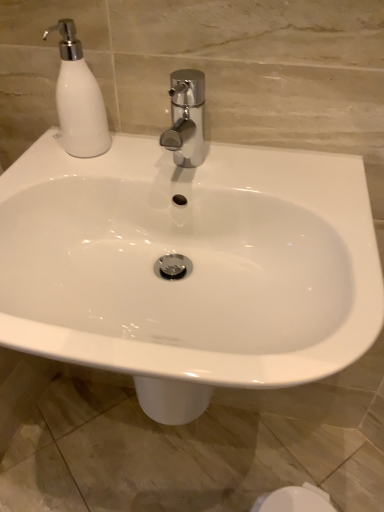
Question: Considering the relative sizes of white glossy soap dispenser at upper left and white glossy sink at center in the image provided, is white glossy soap dispenser at upper left smaller than white glossy sink at center?

Choices:
 (A) yes
 (B) no

Answer: (A)

Question: Does white glossy soap dispenser at upper left appear on the right side of white glossy sink at center?

Choices:
 (A) yes
 (B) no

Answer: (B)

Question: Is white glossy soap dispenser at upper left located outside white glossy sink at center?

Choices:
 (A) yes
 (B) no

Answer: (A)

Question: Could you tell me if white glossy soap dispenser at upper left is turned towards white glossy sink at center?

Choices:
 (A) yes
 (B) no

Answer: (B)

Question: Is white glossy soap dispenser at upper left in contact with white glossy sink at center?

Choices:
 (A) yes
 (B) no

Answer: (B)

Question: Does white glossy soap dispenser at upper left have a greater height compared to white glossy sink at center?

Choices:
 (A) yes
 (B) no

Answer: (B)

Question: From the image's perspective, does white glossy sink at center appear lower than white glossy soap dispenser at upper left?

Choices:
 (A) yes
 (B) no

Answer: (A)

Question: Would you say white glossy sink at center contains white glossy soap dispenser at upper left?

Choices:
 (A) yes
 (B) no

Answer: (B)

Question: Considering the relative sizes of white glossy sink at center and white glossy soap dispenser at upper left in the image provided, is white glossy sink at center thinner than white glossy soap dispenser at upper left?

Choices:
 (A) yes
 (B) no

Answer: (B)

Question: Is white glossy sink at center located outside white glossy soap dispenser at upper left?

Choices:
 (A) no
 (B) yes

Answer: (B)

Question: Could you tell me if white glossy sink at center is facing white glossy soap dispenser at upper left?

Choices:
 (A) yes
 (B) no

Answer: (B)

Question: Is the depth of white glossy sink at center less than that of white glossy soap dispenser at upper left?

Choices:
 (A) no
 (B) yes

Answer: (B)

Question: In terms of size, does white glossy sink at center appear bigger or smaller than white glossy soap dispenser at upper left?

Choices:
 (A) small
 (B) big

Answer: (B)